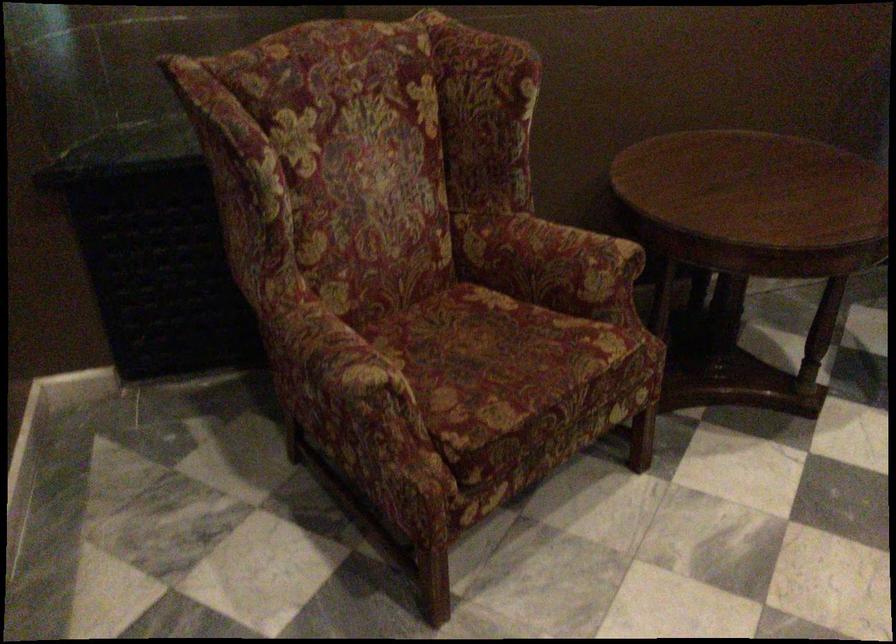
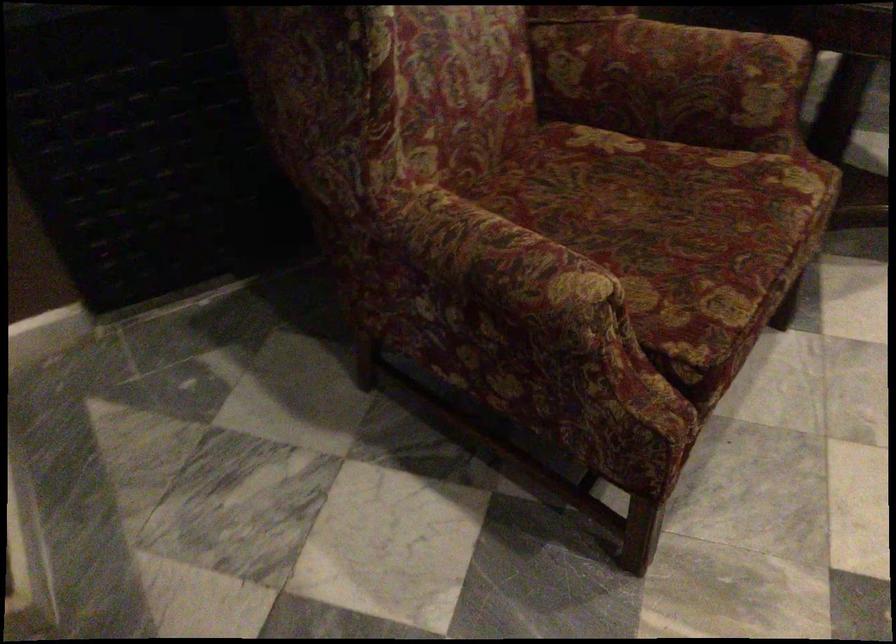
Question: Based on the continuous images, in which direction is the camera rotating? Reply with the corresponding letter.

Choices:
 (A) Left
 (B) Right
 (C) Up
 (D) Down

Answer: (D)